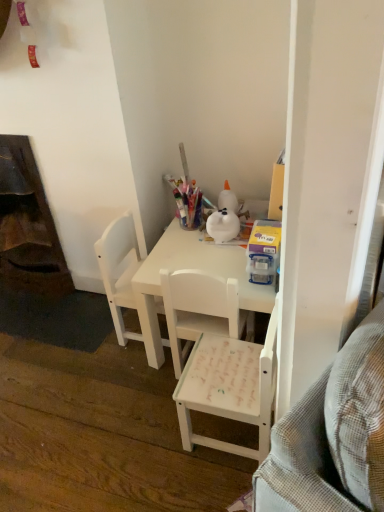
Where is `vacant area on top of white matte desk at center (from a real-world perspective)`? This screenshot has height=512, width=384. vacant area on top of white matte desk at center (from a real-world perspective) is located at coordinates point(207,249).